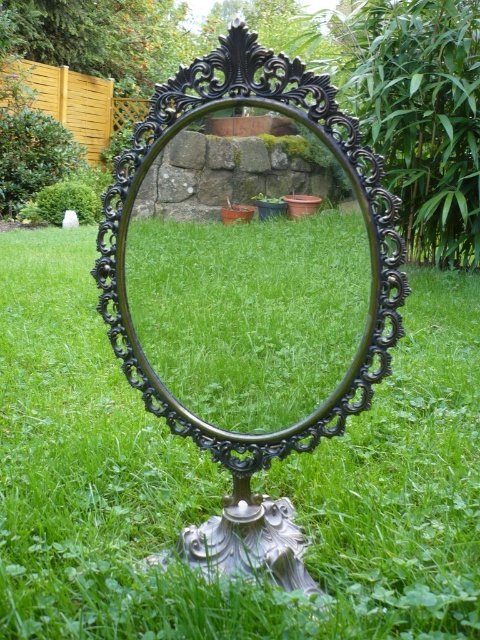
Question: Which of the following is the farthest from the observer?

Choices:
 (A) (386, 554)
 (B) (274, 284)

Answer: (A)

Question: Is green grass at center closer to the viewer compared to black ornate mirror at center?

Choices:
 (A) yes
 (B) no

Answer: (A)

Question: Does green grass at center appear under black ornate mirror at center?

Choices:
 (A) yes
 (B) no

Answer: (A)

Question: Among these objects, which one is nearest to the camera?

Choices:
 (A) black ornate mirror at center
 (B) green grass at center

Answer: (B)

Question: Can you confirm if green grass at center is smaller than black ornate mirror at center?

Choices:
 (A) yes
 (B) no

Answer: (B)